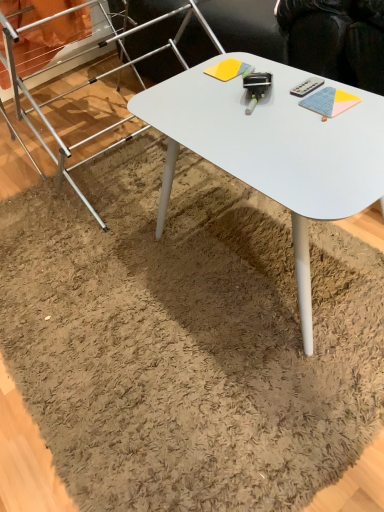
Find the location of a particular element. The width and height of the screenshot is (384, 512). free space that is in between yellow matte notepad at center, arranged as the 2th notepad when ordered from the bottom, and textured blue notepad at upper right, acting as the first notepad starting from the right is located at coordinates (279, 86).